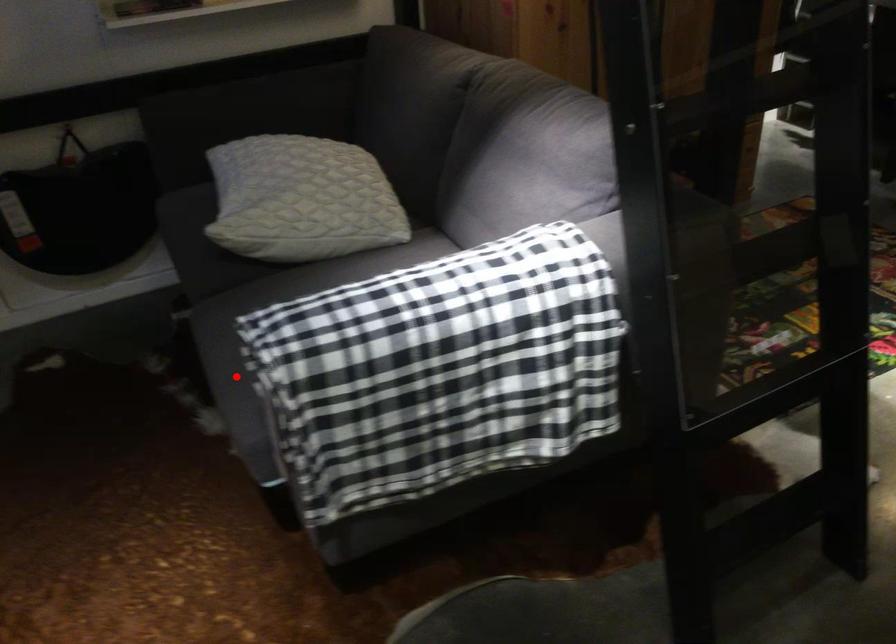
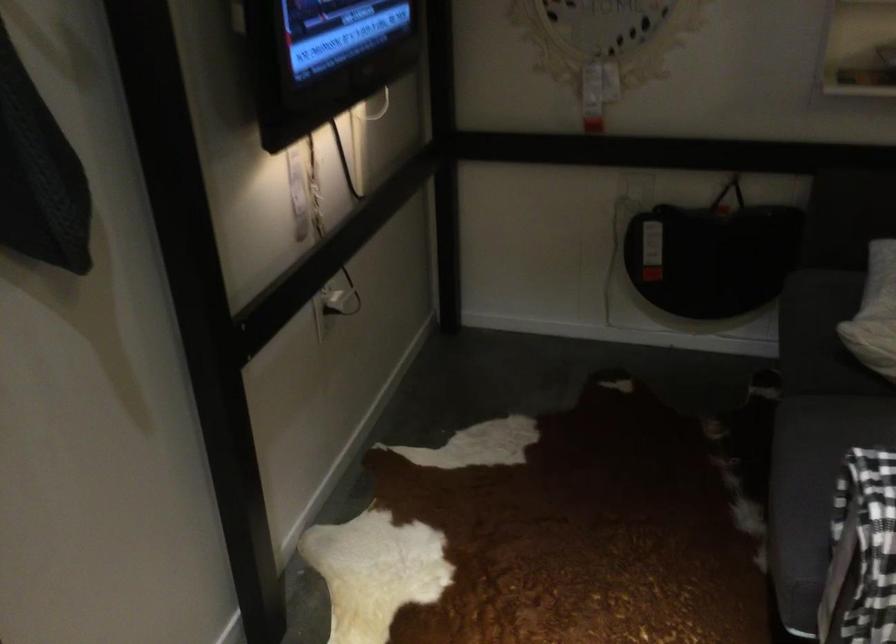
Question: I am providing you with two images of the same scene from different viewpoints. Image1 has a red point marked. In image2, the corresponding 3D location appears at what relative position? Reply with the corresponding letter.

Choices:
 (A) Closer
 (B) Farther

Answer: (A)